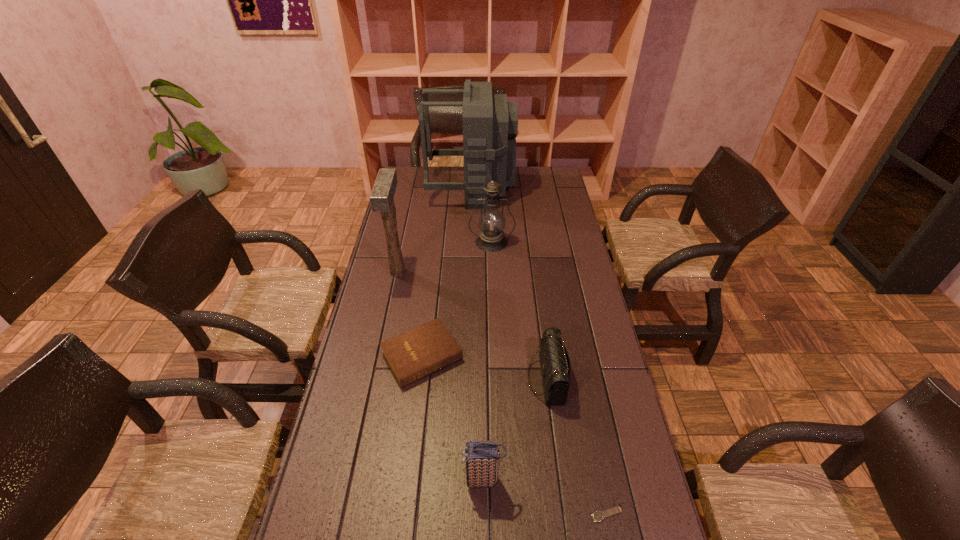
Image resolution: width=960 pixels, height=540 pixels. Find the location of `object that is positioned at the far left corner`. object that is positioned at the far left corner is located at coordinates click(x=490, y=124).

This screenshot has height=540, width=960. I want to click on vacant space at the far edge, so coord(462,169).

Where is `free region at the left edge`? The image size is (960, 540). free region at the left edge is located at coordinates (406, 215).

In the image, there is a desktop. Identify the location of vacant space at the right edge. Image resolution: width=960 pixels, height=540 pixels. (576, 284).

Identify the location of vacant point at the far left corner. The image size is (960, 540). (418, 168).

At what (x,y) coordinates should I click in order to perform the action: click on free space that is in between the left clutch bag and the watch. Please return your answer as a coordinate pair (x, y). The width and height of the screenshot is (960, 540). Looking at the image, I should click on (545, 497).

Identify the location of blank region between the watch and the second shortest object. (515, 435).

Locate an element on the screen. Image resolution: width=960 pixels, height=540 pixels. free space between the mallet and the shorter clutch bag is located at coordinates (472, 325).

Image resolution: width=960 pixels, height=540 pixels. I want to click on free point between the farther clutch bag and the nearest object, so click(577, 446).

You are a GUI agent. You are given a task and a screenshot of the screen. Output one action in this format:
    pyautogui.click(x=<x>, y=<y>)
    Task: Click on the blank region between the sixth tallest object and the mallet
    
    Given the screenshot: What is the action you would take?
    pyautogui.click(x=410, y=315)